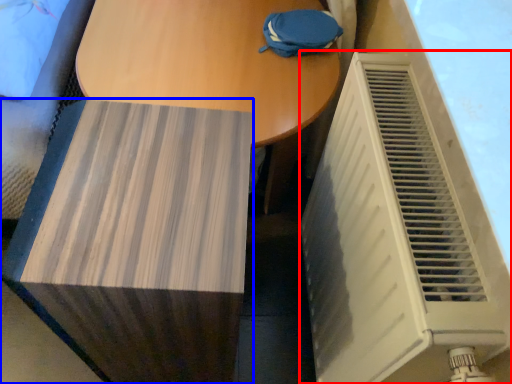
Question: Which point is closer to the camera, air conditioning (highlighted by a red box) or furniture (highlighted by a blue box)?

Choices:
 (A) air conditioning
 (B) furniture

Answer: (A)